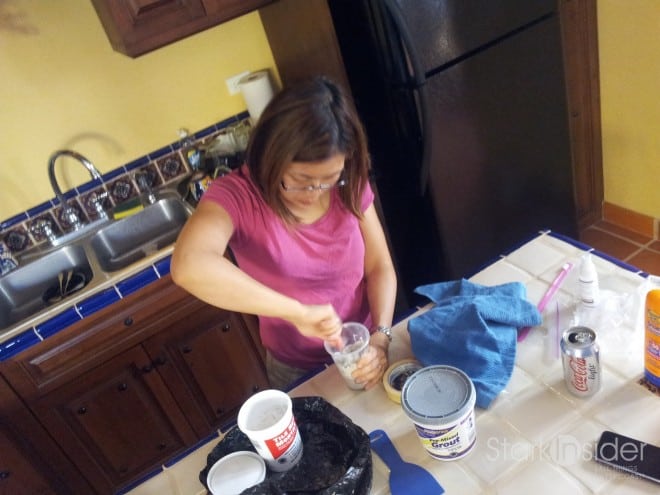
Locate an element on the screen. This screenshot has width=660, height=495. refrigerator is located at coordinates (453, 122).